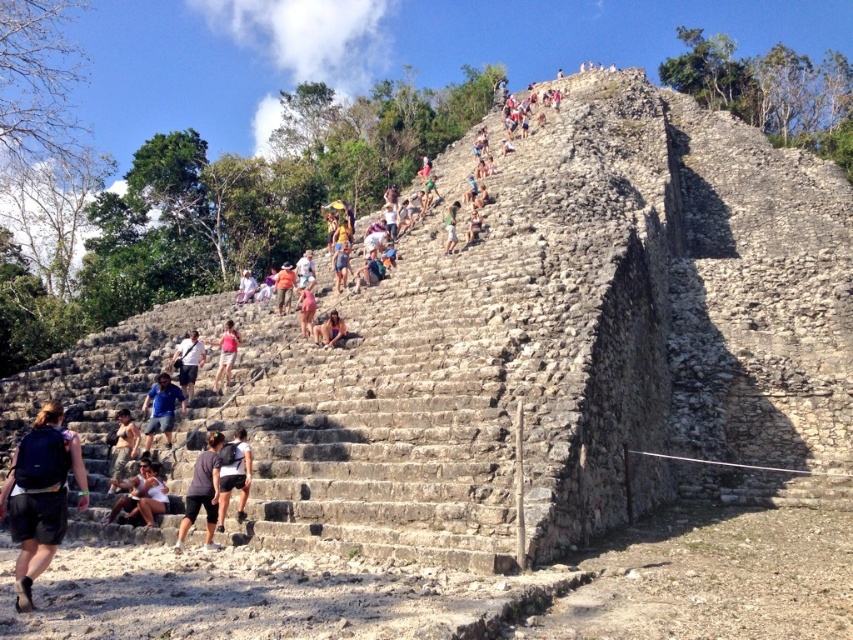
Describe the element at coordinates (305, 305) in the screenshot. This screenshot has width=853, height=640. I see `pink fabric dress at center` at that location.

Consider the image. Does pink fabric dress at center appear under white cotton shirt at center?

Yes.

Where is `pink fabric dress at center`? The image size is (853, 640). pink fabric dress at center is located at coordinates point(305,305).

The height and width of the screenshot is (640, 853). In order to click on pink fabric dress at center in this screenshot , I will do `click(305, 305)`.

Does matte black backpack at lower left have a lesser height compared to pink fabric dress at center?

In fact, matte black backpack at lower left may be taller than pink fabric dress at center.

Between point (80, 506) and point (306, 330), which one is positioned behind?

Positioned behind is point (306, 330).

Locate an element on the screen. matte black backpack at lower left is located at coordinates (39, 496).

Is the position of matte black backpack at lower left less distant than that of matte pink bikini at center?

That is True.

Can you confirm if matte black backpack at lower left is taller than matte pink bikini at center?

Indeed, matte black backpack at lower left has a greater height compared to matte pink bikini at center.

Between point (44, 467) and point (321, 332), which one is positioned behind?

The point (321, 332) is behind.

The width and height of the screenshot is (853, 640). In order to click on matte black backpack at lower left in this screenshot , I will do `click(39, 496)`.